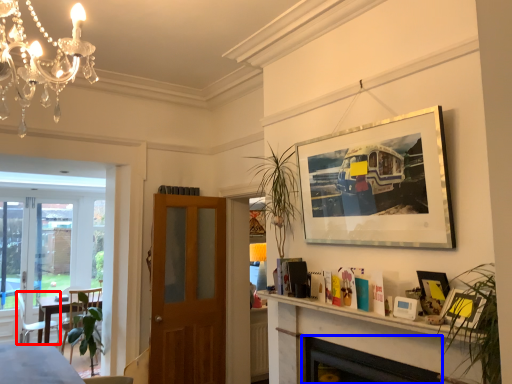
Question: Among these objects, which one is farthest to the camera, chair (highlighted by a red box) or fireplace (highlighted by a blue box)?

Choices:
 (A) chair
 (B) fireplace

Answer: (A)